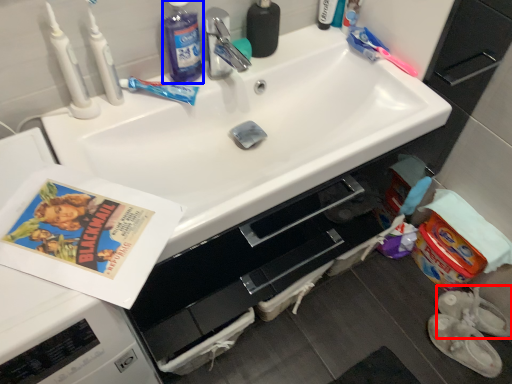
Question: Which of the following is the farthest to the observer, footwear (highlighted by a red box) or cleaning product (highlighted by a blue box)?

Choices:
 (A) footwear
 (B) cleaning product

Answer: (A)